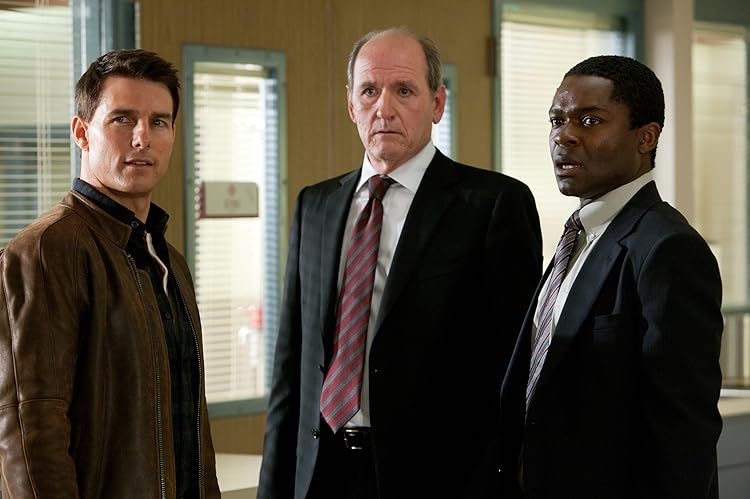
This screenshot has width=750, height=499. Find the location of `tables`. tables is located at coordinates (235, 478), (721, 416).